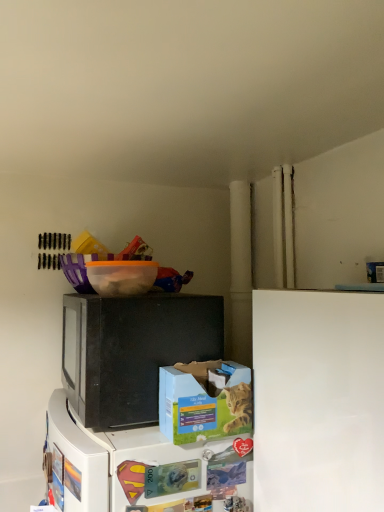
Question: From the image's perspective, does black matte microwave at center appear lower than blue cardboard box at lower center?

Choices:
 (A) yes
 (B) no

Answer: (B)

Question: Is black matte microwave at center closer to the viewer compared to blue cardboard box at lower center?

Choices:
 (A) no
 (B) yes

Answer: (A)

Question: Considering the relative sizes of black matte microwave at center and blue cardboard box at lower center in the image provided, is black matte microwave at center taller than blue cardboard box at lower center?

Choices:
 (A) yes
 (B) no

Answer: (A)

Question: Considering the relative sizes of black matte microwave at center and blue cardboard box at lower center in the image provided, is black matte microwave at center shorter than blue cardboard box at lower center?

Choices:
 (A) yes
 (B) no

Answer: (B)

Question: From the image's perspective, does black matte microwave at center appear higher than blue cardboard box at lower center?

Choices:
 (A) no
 (B) yes

Answer: (B)

Question: From a real-world perspective, is black matte microwave at center over blue cardboard box at lower center?

Choices:
 (A) yes
 (B) no

Answer: (A)

Question: Is black matte microwave at center bigger than orange translucent bowl at upper center?

Choices:
 (A) no
 (B) yes

Answer: (B)

Question: Is black matte microwave at center facing away from orange translucent bowl at upper center?

Choices:
 (A) yes
 (B) no

Answer: (B)

Question: Can you confirm if black matte microwave at center is smaller than orange translucent bowl at upper center?

Choices:
 (A) yes
 (B) no

Answer: (B)

Question: Can orange translucent bowl at upper center be found inside black matte microwave at center?

Choices:
 (A) yes
 (B) no

Answer: (B)

Question: Is black matte microwave at center thinner than orange translucent bowl at upper center?

Choices:
 (A) yes
 (B) no

Answer: (B)

Question: Considering the relative sizes of black matte microwave at center and orange translucent bowl at upper center in the image provided, is black matte microwave at center wider than orange translucent bowl at upper center?

Choices:
 (A) no
 (B) yes

Answer: (B)

Question: Is white matte refrigerator at lower right not inside orange translucent bowl at upper center?

Choices:
 (A) yes
 (B) no

Answer: (A)